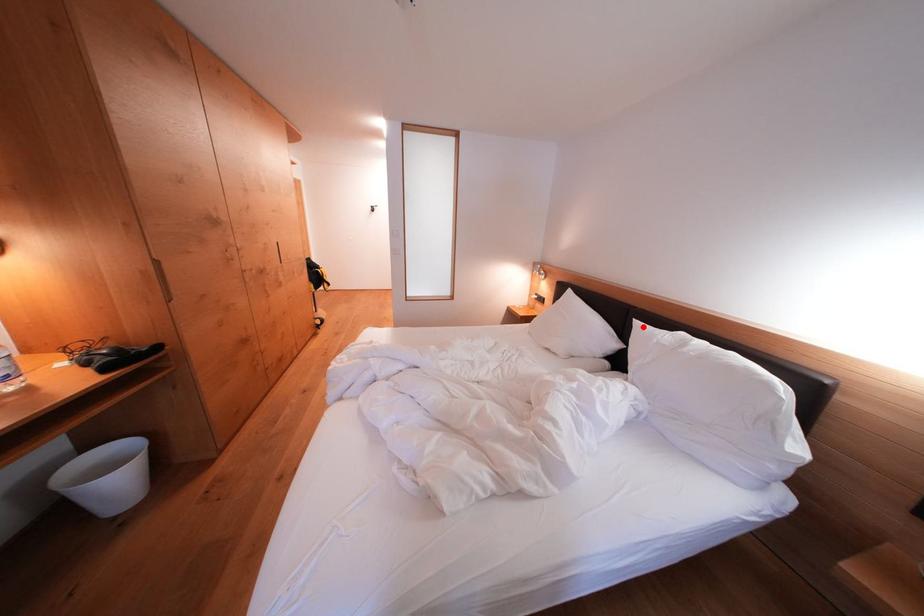
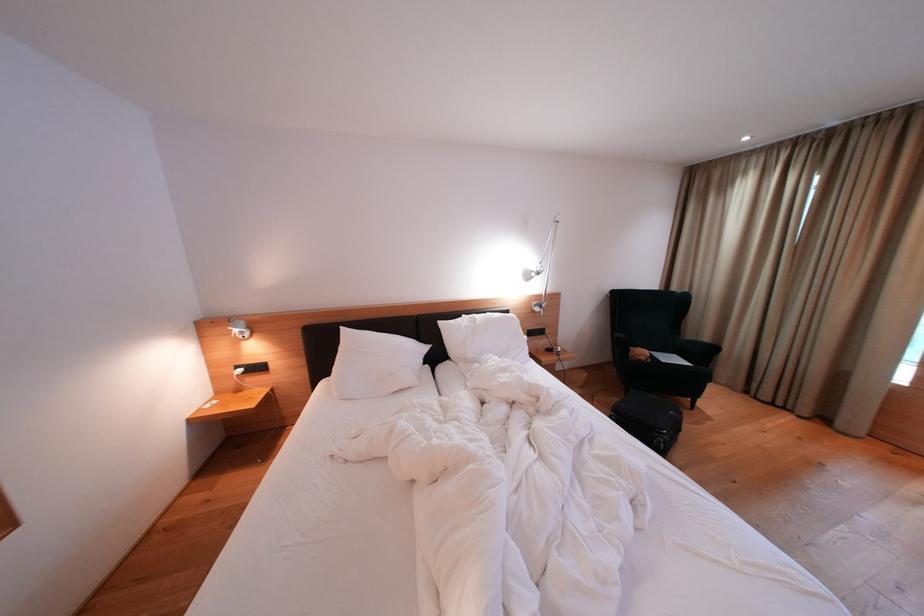
In the second image, find the point that corresponds to the highlighted location in the first image.

(447, 328)